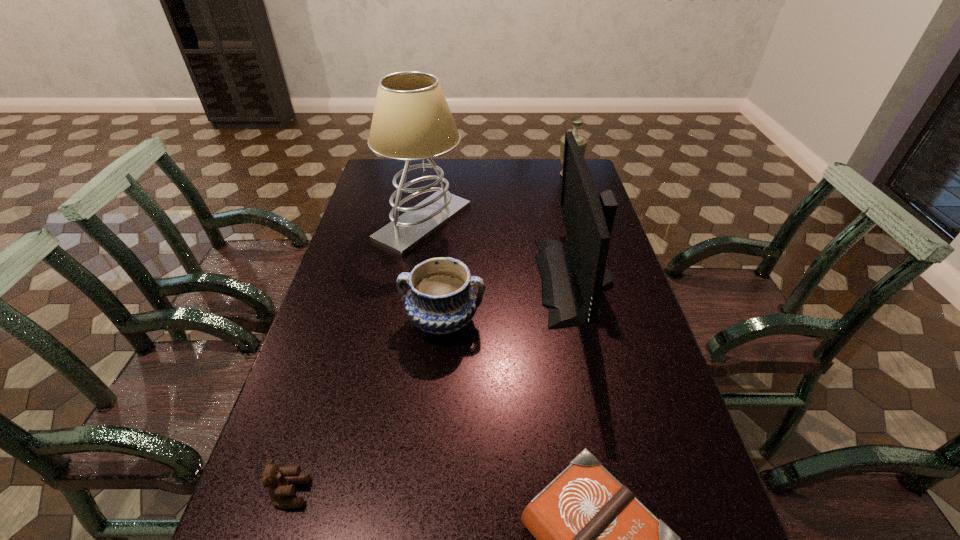
Where is `vacant area located on the front of the farthest object`? vacant area located on the front of the farthest object is located at coordinates (576, 199).

Where is `free space located 0.310m on the back of the third shortest object`? The image size is (960, 540). free space located 0.310m on the back of the third shortest object is located at coordinates click(x=450, y=232).

This screenshot has height=540, width=960. In order to click on free space located on the face of the teddy bear in this screenshot , I will do point(500,493).

This screenshot has height=540, width=960. Identify the location of object that is at the far edge. (582, 141).

The image size is (960, 540). Identify the location of table lamp that is at the left edge. (411, 121).

At what (x,y) coordinates should I click in order to perform the action: click on teddy bear present at the left edge. Please return your answer as a coordinate pair (x, y). This screenshot has height=540, width=960. Looking at the image, I should click on (280, 483).

Identify the location of monitor present at the right edge. (573, 279).

You are a GUI agent. You are given a task and a screenshot of the screen. Output one action in this format:
    pyautogui.click(x=<x>, y=<y>)
    Task: Click on the urn at the right edge
    The height and width of the screenshot is (540, 960).
    Given the screenshot: What is the action you would take?
    pyautogui.click(x=582, y=141)

At what (x,y) coordinates should I click in order to perform the action: click on object that is at the far right corner. Please return your answer as a coordinate pair (x, y). This screenshot has width=960, height=540. Looking at the image, I should click on (582, 141).

The height and width of the screenshot is (540, 960). I want to click on vacant space at the far edge of the desktop, so click(444, 168).